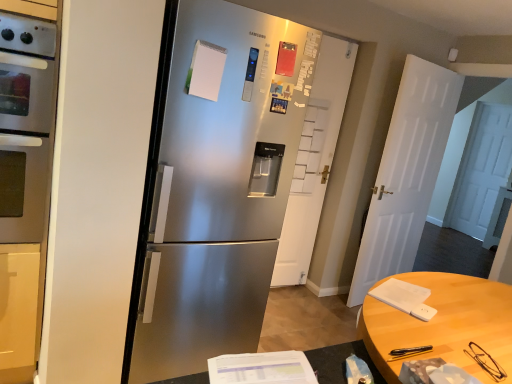
Question: From the image's perspective, is light brown wooden table at lower right positioned above or below white matte door at center, arranged as the second door when viewed from the left?

Choices:
 (A) above
 (B) below

Answer: (B)

Question: In the image, is light brown wooden table at lower right positioned in front of or behind white matte door at center, which is counted as the first door, starting from the right?

Choices:
 (A) front
 (B) behind

Answer: (A)

Question: Which object is the closest to the white matte door at center, the 1th door positioned from the left?

Choices:
 (A) satin silver oven at left
 (B) white matte door at center, which is counted as the first door, starting from the right
 (C) light brown wooden table at lower right
 (D) satin silver refrigerator at center

Answer: (B)

Question: Which of these objects is positioned closest to the white matte door at center, which is counted as the first door, starting from the right?

Choices:
 (A) satin silver oven at left
 (B) white matte door at center, the 1th door positioned from the left
 (C) light brown wooden table at lower right
 (D) satin silver refrigerator at center

Answer: (B)